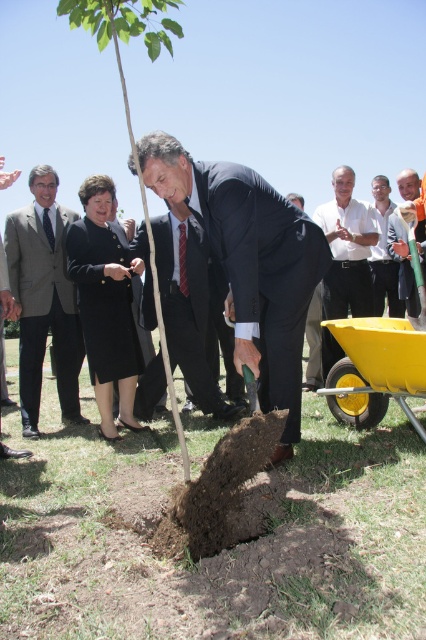
You are a photographer standing at the edge of the ceremony area. You want to capture a photo that includes both the green leafy tree at center and the light brown wooden shovel at center. Given that your camera has a maximum focus range of 4 meters, will you be able to include both objects in the same frame without moving closer or farther away?

The green leafy tree at center and the light brown wooden shovel at center are 4.10 meters apart from each other. Since the distance between them exceeds the camera maximum focus range of 4 meters, you cannot include both in the same frame without adjusting your position.

You are a photographer at the tree planting ceremony. You need to move your camera to the yellow plastic wagon at lower right to place your equipment. Considering the distance between them, can you carry your camera to the wagon without moving it more than 12 feet?

The camera and yellow plastic wagon at lower right are 11.55 feet apart, so yes, you can carry your camera to the wagon without exceeding the 12 feet limit.